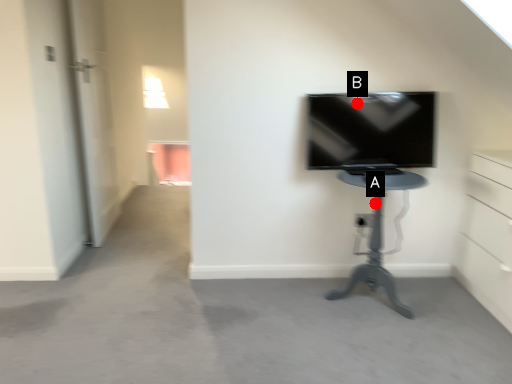
Question: Two points are circled on the image, labeled by A and B beside each circle. Among these points, which one is farthest from the camera?

Choices:
 (A) A is further
 (B) B is further

Answer: (B)